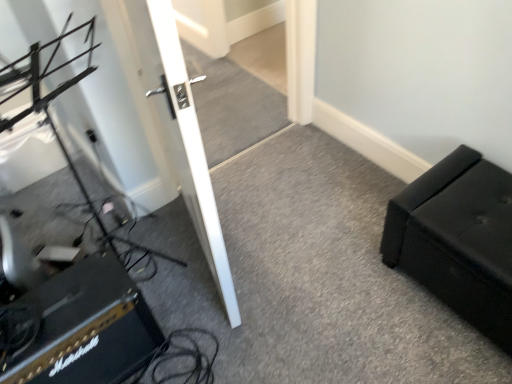
Question: From a real-world perspective, is white glossy door at center on black textured amplifier at lower left?

Choices:
 (A) yes
 (B) no

Answer: (A)

Question: Considering the relative positions of white glossy door at center and black textured amplifier at lower left in the image provided, is white glossy door at center to the left of black textured amplifier at lower left from the viewer's perspective?

Choices:
 (A) yes
 (B) no

Answer: (B)

Question: Is white glossy door at center not near black textured amplifier at lower left?

Choices:
 (A) no
 (B) yes

Answer: (A)

Question: Is white glossy door at center located outside black textured amplifier at lower left?

Choices:
 (A) yes
 (B) no

Answer: (A)

Question: From a real-world perspective, does white glossy door at center sit lower than black textured amplifier at lower left?

Choices:
 (A) no
 (B) yes

Answer: (A)

Question: Is point (471, 292) closer or farther from the camera than point (184, 165)?

Choices:
 (A) closer
 (B) farther

Answer: (B)

Question: Relative to white glossy door at center, is black leather ottoman at right in front or behind?

Choices:
 (A) behind
 (B) front

Answer: (A)

Question: From the image's perspective, is black leather ottoman at right above or below white glossy door at center?

Choices:
 (A) above
 (B) below

Answer: (B)

Question: Would you say black leather ottoman at right is inside or outside white glossy door at center?

Choices:
 (A) inside
 (B) outside

Answer: (B)

Question: Visually, is black textured amplifier at lower left positioned to the left or to the right of white glossy door at center?

Choices:
 (A) left
 (B) right

Answer: (A)

Question: Looking at their shapes, would you say black textured amplifier at lower left is wider or thinner than white glossy door at center?

Choices:
 (A) wide
 (B) thin

Answer: (A)

Question: From a real-world perspective, relative to white glossy door at center, is black textured amplifier at lower left vertically above or below?

Choices:
 (A) below
 (B) above

Answer: (A)

Question: From the image's perspective, is black textured amplifier at lower left positioned above or below white glossy door at center?

Choices:
 (A) below
 (B) above

Answer: (A)

Question: Choose the correct answer: Is white glossy door at center inside black leather ottoman at right or outside it?

Choices:
 (A) inside
 (B) outside

Answer: (B)

Question: Looking at their shapes, would you say white glossy door at center is wider or thinner than black leather ottoman at right?

Choices:
 (A) wide
 (B) thin

Answer: (B)